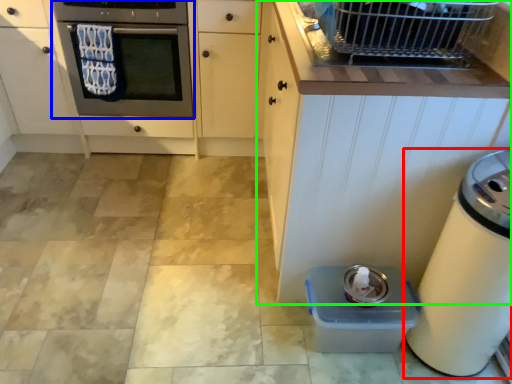
Question: Which is farther away from home appliance (highlighted by a red box)? oven (highlighted by a blue box) or cabinetry (highlighted by a green box)?

Choices:
 (A) oven
 (B) cabinetry

Answer: (A)